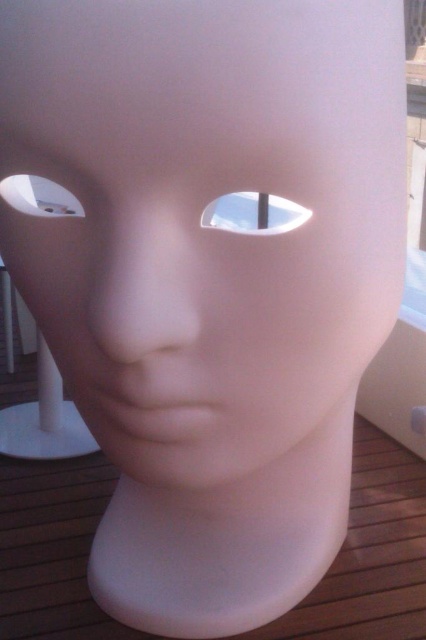
You are an artist examining the sculpture and want to place a small sticker on the larger of the two white features. Which feature should you choose between the white glossy eye at center and the white matte hole at left?

The white glossy eye at center is bigger than the white matte hole at left, so you should place the sticker on the white glossy eye at center.

You are an artist standing in front of the sculpture and want to paint the white glossy eye at center and the white matte hole at left. Which object should you move closer to first if you want to paint both without moving the sculpture?

You should move closer to the white glossy eye at center first because the white matte hole at left is behind it, so you can reach the eye first without obstructing the view of the hole.

You are an artist trying to place a small statue that is 10 cm tall between the white glossy eye at center and the white matte hole at left. Based on their sizes, will the statue fit vertically between them?

The white glossy eye at center is much taller than the white matte hole at left. Since the statue is only 10 cm tall, it should fit vertically between them as long as the distance between their bases allows.